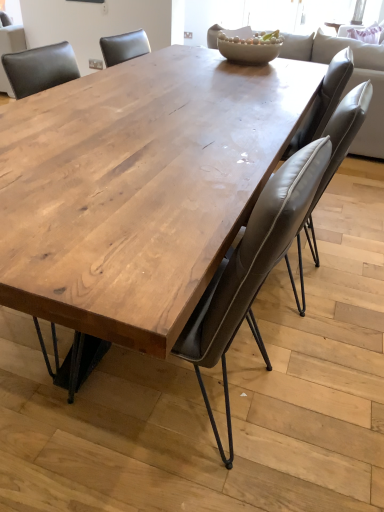
Question: Does matte wood table at center, acting as the first chair starting from the left, have a lesser width compared to leather at center, acting as the 2th chair starting from the left?

Choices:
 (A) no
 (B) yes

Answer: (B)

Question: Does matte wood table at center, which ranks as the second chair in right-to-left order, come behind leather at center, the 1th chair when ordered from right to left?

Choices:
 (A) yes
 (B) no

Answer: (B)

Question: Is matte wood table at center, acting as the first chair starting from the left, at the left side of leather at center, the 1th chair when ordered from right to left?

Choices:
 (A) no
 (B) yes

Answer: (B)

Question: Is matte wood table at center, which ranks as the second chair in right-to-left order, looking in the opposite direction of leather at center, the 1th chair when ordered from right to left?

Choices:
 (A) no
 (B) yes

Answer: (A)

Question: From a real-world perspective, is matte wood table at center, which ranks as the second chair in right-to-left order, physically below leather at center, the 1th chair when ordered from right to left?

Choices:
 (A) yes
 (B) no

Answer: (A)

Question: From a real-world perspective, is matte wood table at center, which ranks as the second chair in right-to-left order, positioned above or below light gray leather couch at upper center?

Choices:
 (A) below
 (B) above

Answer: (A)

Question: Relative to light gray leather couch at upper center, is matte wood table at center, acting as the first chair starting from the left, in front or behind?

Choices:
 (A) front
 (B) behind

Answer: (A)

Question: Looking at the image, does matte wood table at center, which ranks as the second chair in right-to-left order, seem bigger or smaller compared to light gray leather couch at upper center?

Choices:
 (A) small
 (B) big

Answer: (A)

Question: Is matte wood table at center, acting as the first chair starting from the left, taller or shorter than light gray leather couch at upper center?

Choices:
 (A) tall
 (B) short

Answer: (B)

Question: Is natural wood table at center wider or thinner than matte wood table at center, which ranks as the second chair in right-to-left order?

Choices:
 (A) wide
 (B) thin

Answer: (A)

Question: Do you think natural wood table at center is within matte wood table at center, which ranks as the second chair in right-to-left order, or outside of it?

Choices:
 (A) outside
 (B) inside

Answer: (A)

Question: From a real-world perspective, is natural wood table at center above or below matte wood table at center, acting as the first chair starting from the left?

Choices:
 (A) above
 (B) below

Answer: (B)

Question: Considering the positions of point (119, 273) and point (39, 54), is point (119, 273) closer or farther from the camera than point (39, 54)?

Choices:
 (A) closer
 (B) farther

Answer: (A)

Question: From a real-world perspective, is leather at center, the 1th chair when ordered from right to left, physically located above or below matte wood table at center, acting as the first chair starting from the left?

Choices:
 (A) below
 (B) above

Answer: (B)

Question: Relative to matte wood table at center, acting as the first chair starting from the left, is leather at center, acting as the 2th chair starting from the left, in front or behind?

Choices:
 (A) front
 (B) behind

Answer: (B)